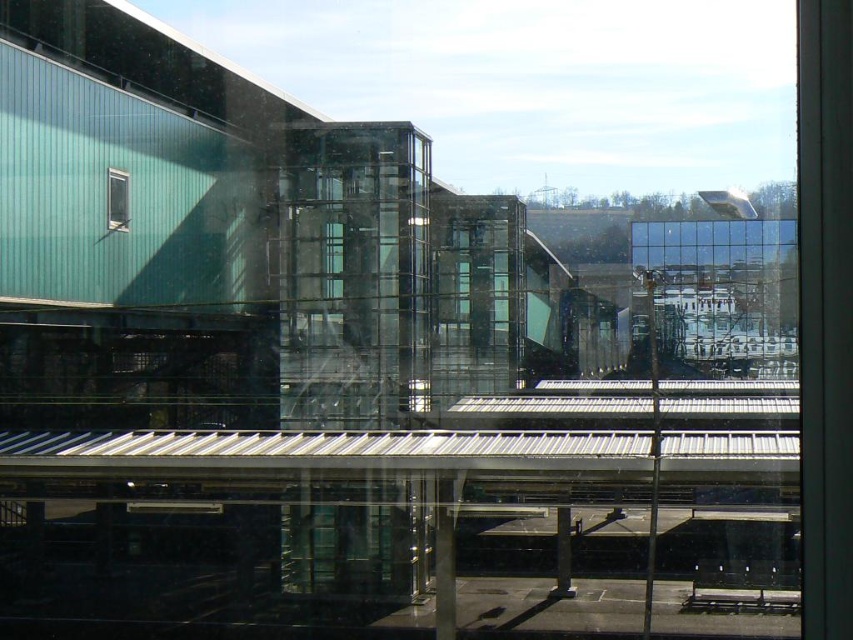
Question: Can you confirm if transparent glass window at center is positioned below clear glass window at upper left?

Choices:
 (A) yes
 (B) no

Answer: (A)

Question: Is transparent glass window at center to the left of clear glass window at upper left from the viewer's perspective?

Choices:
 (A) no
 (B) yes

Answer: (A)

Question: Where is transparent glass window at center located in relation to clear glass window at upper left in the image?

Choices:
 (A) left
 (B) right

Answer: (B)

Question: Among these points, which one is farthest from the camera?

Choices:
 (A) (120, 172)
 (B) (341, 230)

Answer: (A)

Question: Among these objects, which one is farthest from the camera?

Choices:
 (A) transparent glass window at center
 (B) clear glass window at upper left

Answer: (B)